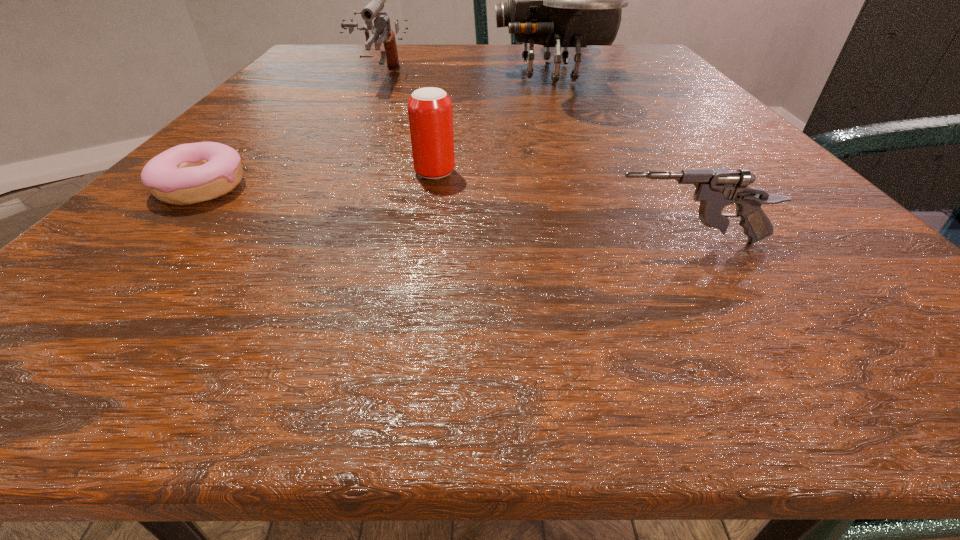
Where is `gun that is at the left edge`? This screenshot has height=540, width=960. gun that is at the left edge is located at coordinates (381, 27).

In order to click on doughnut at the left edge in this screenshot , I will do coord(186,174).

The height and width of the screenshot is (540, 960). I want to click on drone that is at the right edge, so click(557, 0).

Where is `gun located at the right edge`? The width and height of the screenshot is (960, 540). gun located at the right edge is located at coordinates (715, 189).

Where is `object situated at the far left corner`? object situated at the far left corner is located at coordinates (381, 27).

Where is `object located in the far right corner section of the desktop`? The image size is (960, 540). object located in the far right corner section of the desktop is located at coordinates (557, 0).

This screenshot has height=540, width=960. I want to click on vacant space at the far edge of the desktop, so click(x=412, y=59).

In the image, there is a desktop. At what (x,y) coordinates should I click in order to perform the action: click on vacant space at the near edge. Please return your answer as a coordinate pair (x, y). Image resolution: width=960 pixels, height=540 pixels. Looking at the image, I should click on (729, 314).

At what (x,y) coordinates should I click in order to perform the action: click on free space at the left edge. Please return your answer as a coordinate pair (x, y). Looking at the image, I should click on (142, 232).

In the image, there is a desktop. Identify the location of blank space at the right edge. (765, 152).